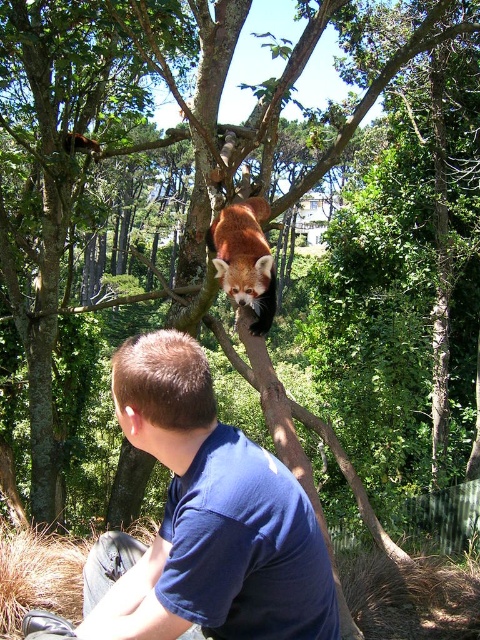
You are standing in the forest and see two points marked in the image. Which point is closer to you, point (228,557) or point (220,248)?

Point (228,557) is in front of point (220,248), so it is closer to you.